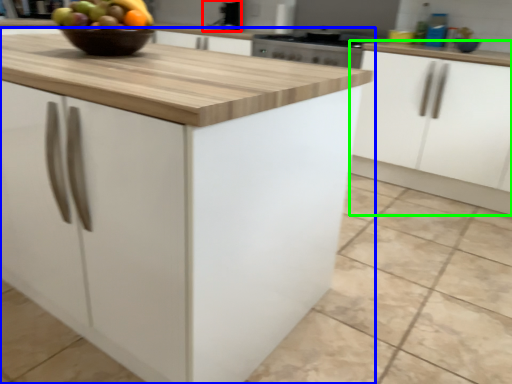
Question: Considering the real-world distances, which object is farthest from sink (highlighted by a red box)? cabinetry (highlighted by a blue box) or cabinetry (highlighted by a green box)?

Choices:
 (A) cabinetry
 (B) cabinetry

Answer: (A)